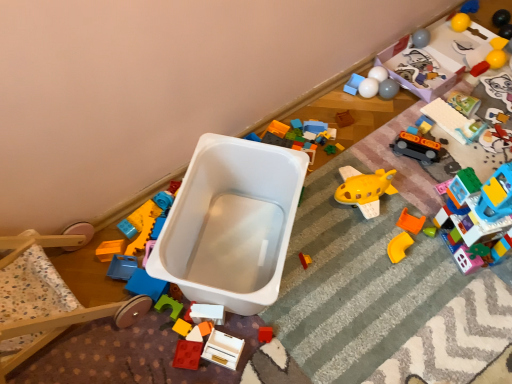
Find the location of `free space that is in between white plastic baby carriage at center and orange plastic train at center, the eleventh toy positioned from the left`. free space that is in between white plastic baby carriage at center and orange plastic train at center, the eleventh toy positioned from the left is located at coordinates point(345,213).